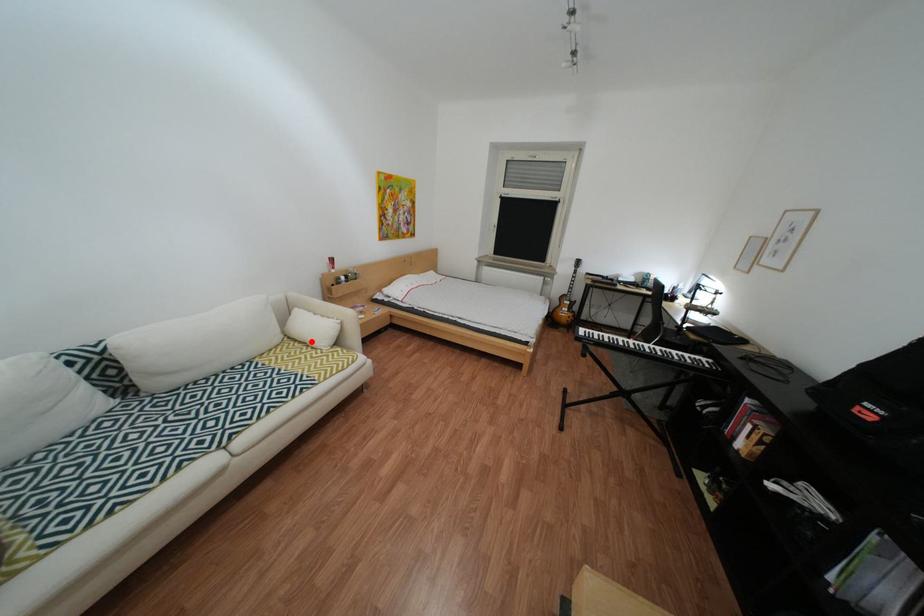
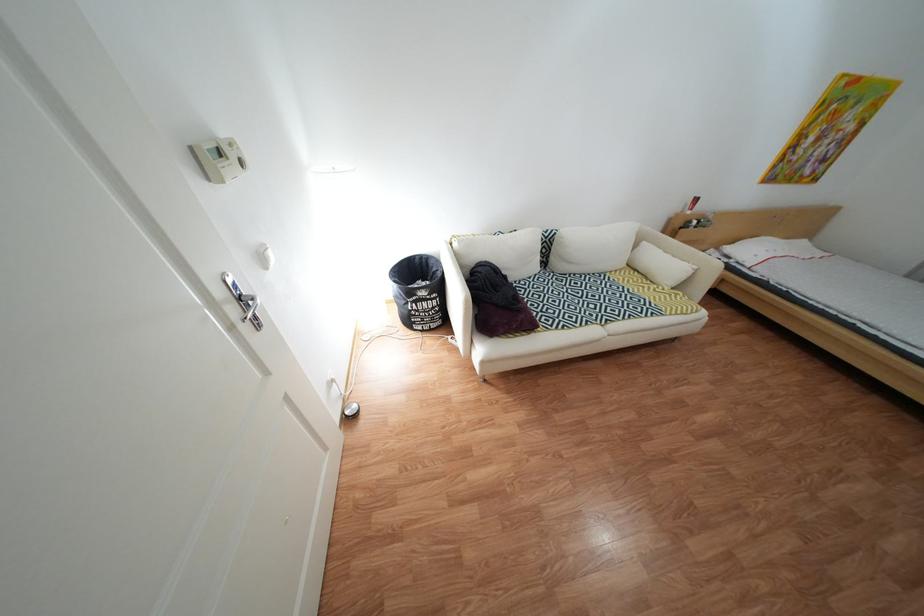
Where in the second image is the point corresponding to the highlighted location from the first image?

(651, 272)